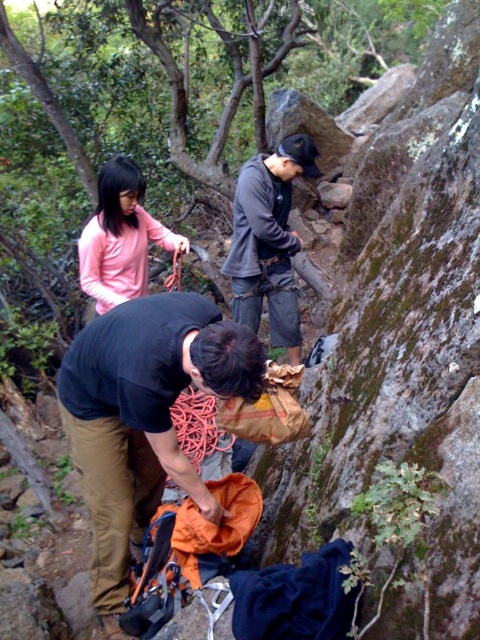
Question: Estimate the real-world distances between objects in this image. Which object is closer to the black fabric backpack at center?

Choices:
 (A) dark gray fabric climbing harness at center
 (B) matte pink shirt at upper left

Answer: (B)

Question: Which point is farther from the camera taking this photo?

Choices:
 (A) (110, 214)
 (B) (159, 493)

Answer: (A)

Question: Can you confirm if black fabric backpack at center is wider than matte pink shirt at upper left?

Choices:
 (A) no
 (B) yes

Answer: (B)

Question: Can you confirm if matte pink shirt at upper left is wider than orange nylon rope at center?

Choices:
 (A) yes
 (B) no

Answer: (A)

Question: Can you confirm if black fabric backpack at center is wider than dark gray fabric climbing harness at center?

Choices:
 (A) no
 (B) yes

Answer: (B)

Question: Which point is farther from the camera taking this photo?

Choices:
 (A) (130, 218)
 (B) (278, 157)

Answer: (B)